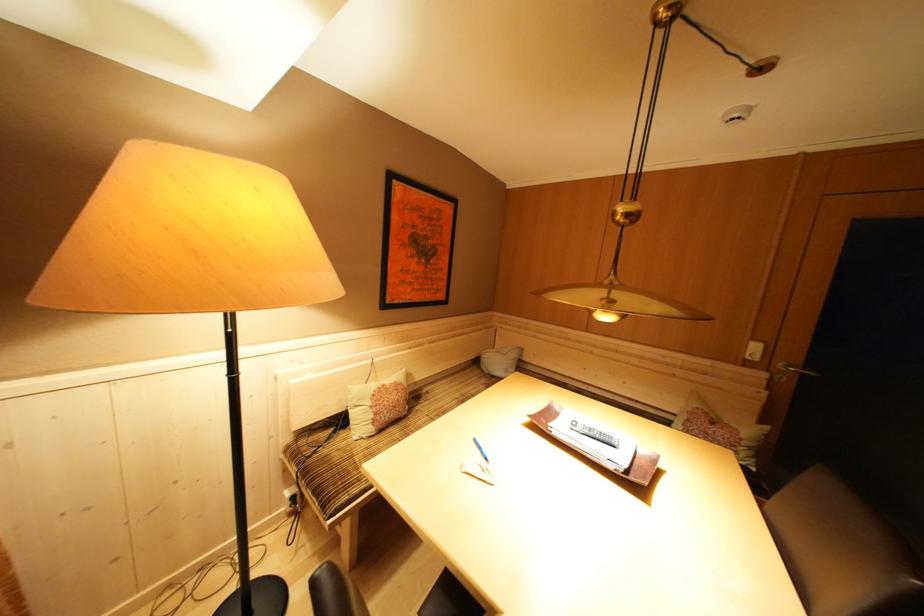
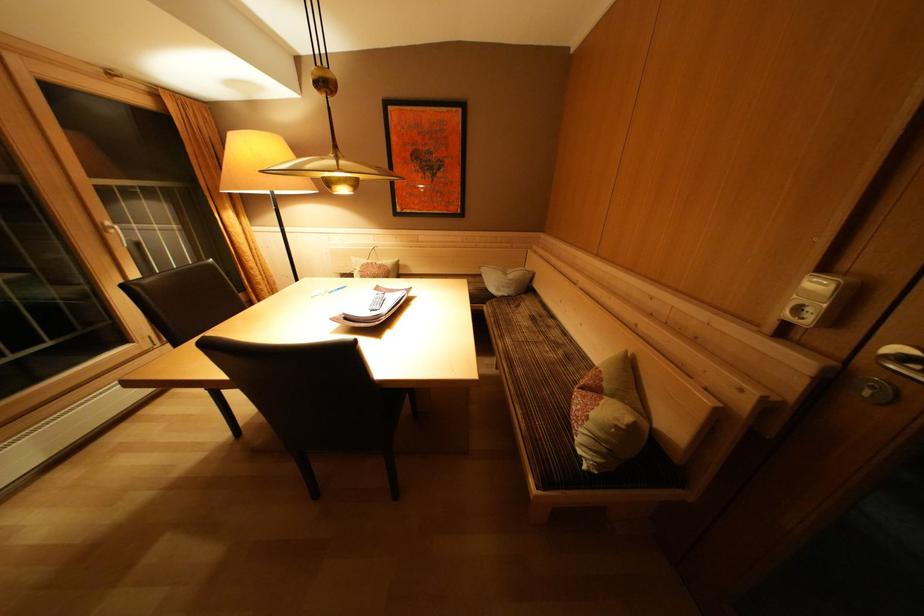
In the second image, find the point that corresponds to point 764,363 in the first image.

(815, 326)